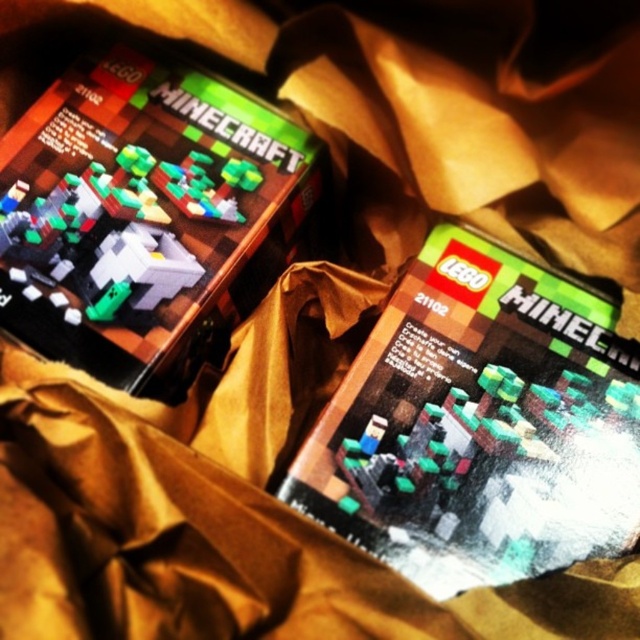
You are a delivery person who needs to place a matte black lego minecraft set at center on a shelf. The shelf has a grid system with coordinates from 0 to 1 in both x and y directions. Where should you place it to match the image?

The matte black lego minecraft set at center should be placed at the coordinate point (x=480, y=424) to match its position in the image.

You are a delivery person who needs to place a new LEGO Minecraft set on the crumpled brown paper bag. The existing sets are arranged such that there is a point at coordinates (480, 424) which marks the location of the matte black LEGO Minecraft set at center. Where should you place the new set to ensure it doesn t overlap with the existing one?

Place the new LEGO Minecraft set away from the coordinates (480, 424) where the matte black LEGO Minecraft set at center is located to avoid overlap.

You are organizing a LEGO display and need to know the arrangement of the two sets. Which LEGO Minecraft set is closer to you, the matte black lego minecraft set at center or the matte cardboard lego minecraft set at upper left?

The matte black lego minecraft set at center is closer to you because it is in front of the matte cardboard lego minecraft set at upper left.